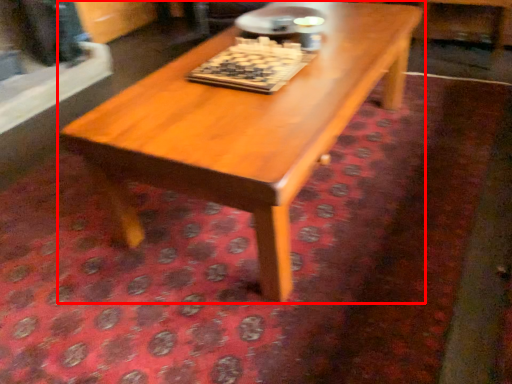
Question: From the image's perspective, what is the correct spatial relationship of coffee table (annotated by the red box) in relation to board game?

Choices:
 (A) below
 (B) above

Answer: (A)